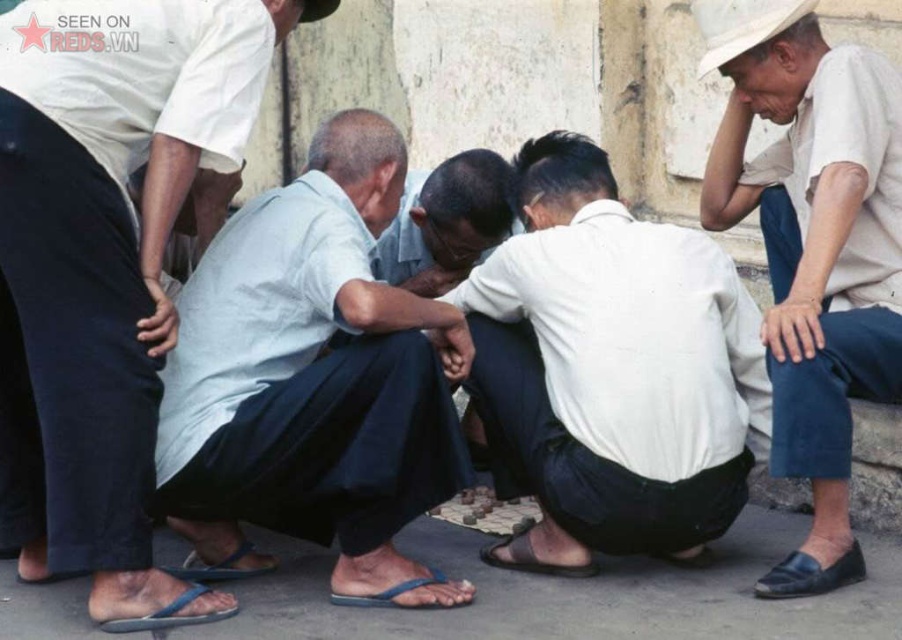
At what (x,y) coordinates should I click in order to perform the action: click on light blue fabric at center. Please return your answer as a coordinate pair (x, y). This screenshot has height=640, width=902. Looking at the image, I should click on [311, 372].

Consider the image. Is light blue fabric at center behind brown leather sandal at lower center?

No, it is in front of brown leather sandal at lower center.

What do you see at coordinates (311, 372) in the screenshot?
I see `light blue fabric at center` at bounding box center [311, 372].

Find the location of a particular element. The height and width of the screenshot is (640, 902). light blue fabric at center is located at coordinates (311, 372).

Is white cotton shirt at upper right further to the viewer compared to blue flip-flop at lower center?

No, it is in front of blue flip-flop at lower center.

Which is behind, point (875, 70) or point (394, 604)?

The point (875, 70) is behind.

You are a GUI agent. You are given a task and a screenshot of the screen. Output one action in this format:
    pyautogui.click(x=<x>, y=<y>)
    Task: Click on the white cotton shirt at upper right
    This screenshot has width=902, height=640.
    Given the screenshot: What is the action you would take?
    pyautogui.click(x=812, y=248)

Image resolution: width=902 pixels, height=640 pixels. I want to click on white cotton shirt at upper right, so click(812, 248).

Is point (812, 385) positioned before point (830, 576)?

Yes, point (812, 385) is in front of point (830, 576).

Is point (900, 234) closer to camera compared to point (857, 577)?

No, (900, 234) is further to viewer.

In order to click on white cotton shirt at upper right in this screenshot , I will do `click(812, 248)`.